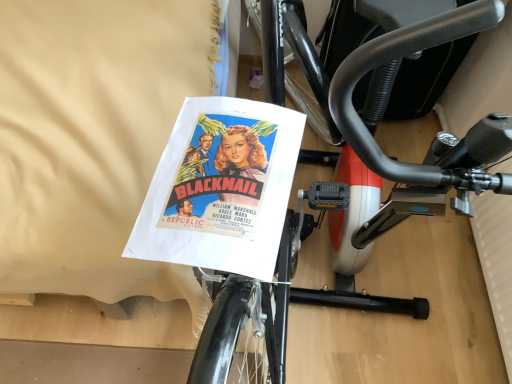
Measure the distance between white paper at upper left and camera.

white paper at upper left is 33.36 inches away from camera.

This screenshot has width=512, height=384. What do you see at coordinates (91, 137) in the screenshot?
I see `white paper at upper left` at bounding box center [91, 137].

The height and width of the screenshot is (384, 512). What are the coordinates of `white paper at upper left` in the screenshot? It's located at (91, 137).

Identify the location of black matte exercise bike at center. (385, 104).

The height and width of the screenshot is (384, 512). Describe the element at coordinates (385, 104) in the screenshot. I see `black matte exercise bike at center` at that location.

Image resolution: width=512 pixels, height=384 pixels. Find the location of `white paper at upper left`. white paper at upper left is located at coordinates (91, 137).

Considering the relative positions of white paper at upper left and black matte exercise bike at center in the image provided, is white paper at upper left to the right of black matte exercise bike at center from the viewer's perspective?

No, white paper at upper left is not to the right of black matte exercise bike at center.

Which object is closer to the camera taking this photo, white paper at upper left or black matte exercise bike at center?

black matte exercise bike at center is in front.

Considering the points (86, 222) and (284, 246), which point is behind, point (86, 222) or point (284, 246)?

Point (284, 246)

From the image's perspective, does white paper at upper left appear higher than black matte exercise bike at center?

Yes, from the image's perspective, white paper at upper left is over black matte exercise bike at center.

From a real-world perspective, is white paper at upper left located beneath black matte exercise bike at center?

Yes, from a real-world perspective, white paper at upper left is below black matte exercise bike at center.

Which object is thinner, white paper at upper left or black matte exercise bike at center?

black matte exercise bike at center is thinner.

Can you confirm if white paper at upper left is shorter than black matte exercise bike at center?

Yes, white paper at upper left is shorter than black matte exercise bike at center.

From the picture: Based on their sizes in the image, would you say white paper at upper left is bigger or smaller than black matte exercise bike at center?

white paper at upper left is bigger than black matte exercise bike at center.

Consider the image. Is white paper at upper left situated inside black matte exercise bike at center or outside?

white paper at upper left is not enclosed by black matte exercise bike at center.

Consider the image. Is white paper at upper left far from black matte exercise bike at center?

white paper at upper left is actually quite close to black matte exercise bike at center.

Does white paper at upper left turn towards black matte exercise bike at center?

No, white paper at upper left is not aimed at black matte exercise bike at center.

Identify the location of sheet below the black matte exercise bike at center (from a real-world perspective). The height and width of the screenshot is (384, 512). (91, 137).

Which object is positioned more to the right, black matte exercise bike at center or white paper at upper left?

black matte exercise bike at center.

Does black matte exercise bike at center lie in front of white paper at upper left?

Yes, black matte exercise bike at center is closer to the viewer.

Which is in front, point (486, 3) or point (17, 23)?

The point (486, 3) is closer to the camera.

From the image's perspective, is black matte exercise bike at center above white paper at upper left?

No, from the image's perspective, black matte exercise bike at center is not on top of white paper at upper left.

From a real-world perspective, is black matte exercise bike at center physically located above or below white paper at upper left?

Clearly, from a real-world perspective, black matte exercise bike at center is above white paper at upper left.

Considering the sizes of black matte exercise bike at center and white paper at upper left in the image, is black matte exercise bike at center wider or thinner than white paper at upper left?

Considering their sizes, black matte exercise bike at center looks slimmer than white paper at upper left.

Between black matte exercise bike at center and white paper at upper left, which one has more height?

black matte exercise bike at center.

Between black matte exercise bike at center and white paper at upper left, which one has smaller size?

With smaller size is black matte exercise bike at center.

Does black matte exercise bike at center contain white paper at upper left?

No, white paper at upper left is not a part of black matte exercise bike at center.

Are black matte exercise bike at center and white paper at upper left far apart?

black matte exercise bike at center is near white paper at upper left, not far away.

Is black matte exercise bike at center facing away from white paper at upper left?

No, black matte exercise bike at center is not facing away from white paper at upper left.

How many degrees apart are the facing directions of black matte exercise bike at center and white paper at upper left?

The angle between the facing direction of black matte exercise bike at center and the facing direction of white paper at upper left is 87 degrees.

Locate an element on the screen. Image resolution: width=512 pixels, height=384 pixels. bicycle above the white paper at upper left (from a real-world perspective) is located at coordinates (385, 104).

At what (x,y) coordinates should I click in order to perform the action: click on sheet that appears below the black matte exercise bike at center (from a real-world perspective). Please return your answer as a coordinate pair (x, y). The width and height of the screenshot is (512, 384). Looking at the image, I should click on (91, 137).

This screenshot has width=512, height=384. Find the location of `sheet that appears on the left of black matte exercise bike at center`. sheet that appears on the left of black matte exercise bike at center is located at coordinates (91, 137).